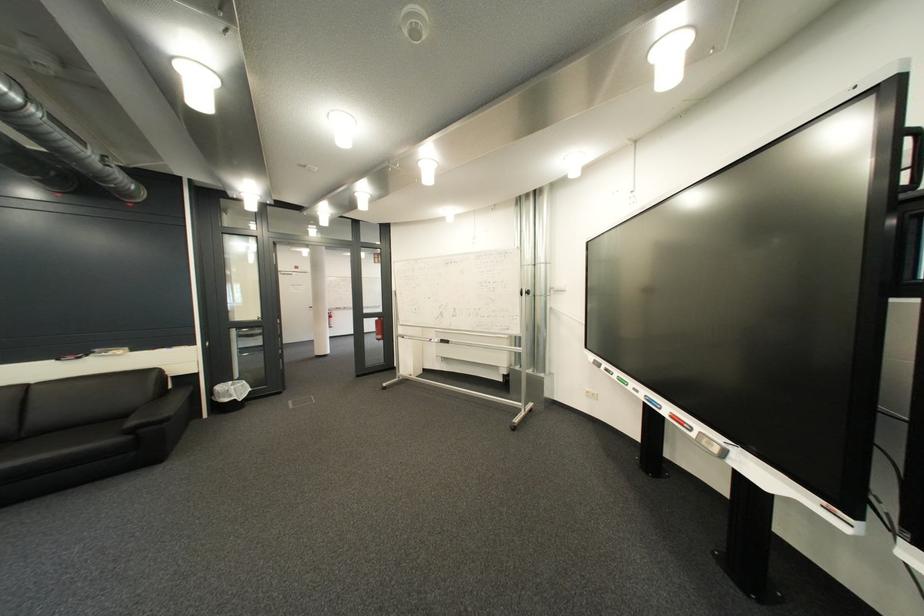
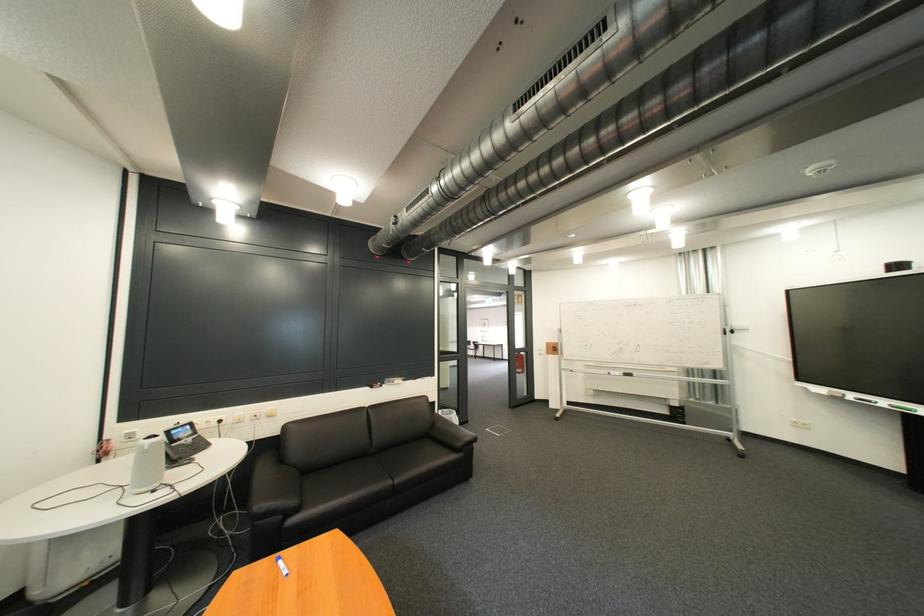
Question: In a continuous first-person perspective shot, in which direction is the camera moving?

Choices:
 (A) Left
 (B) Right
 (C) Forward
 (D) Backward

Answer: (A)